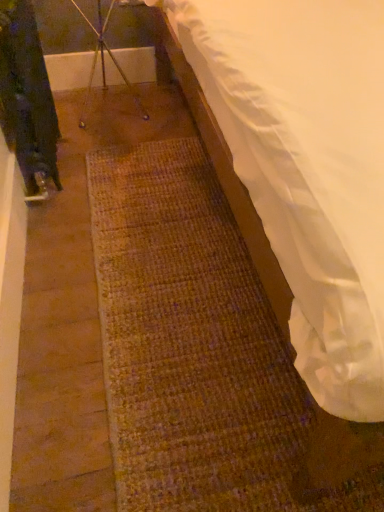
Question: Considering the positions of point (306, 15) and point (109, 14), is point (306, 15) closer or farther from the camera than point (109, 14)?

Choices:
 (A) closer
 (B) farther

Answer: (A)

Question: From a real-world perspective, relative to metallic tripod at upper center, is white fabric mattress at lower right vertically above or below?

Choices:
 (A) above
 (B) below

Answer: (A)

Question: Which is correct: white fabric mattress at lower right is inside metallic tripod at upper center, or outside of it?

Choices:
 (A) inside
 (B) outside

Answer: (B)

Question: Is metallic tripod at upper center spatially inside white fabric mattress at lower right, or outside of it?

Choices:
 (A) outside
 (B) inside

Answer: (A)

Question: Is metallic tripod at upper center in front of or behind white fabric mattress at lower right in the image?

Choices:
 (A) behind
 (B) front

Answer: (A)

Question: From a real-world perspective, relative to white fabric mattress at lower right, is metallic tripod at upper center vertically above or below?

Choices:
 (A) above
 (B) below

Answer: (B)

Question: Is metallic tripod at upper center bigger or smaller than white fabric mattress at lower right?

Choices:
 (A) small
 (B) big

Answer: (A)